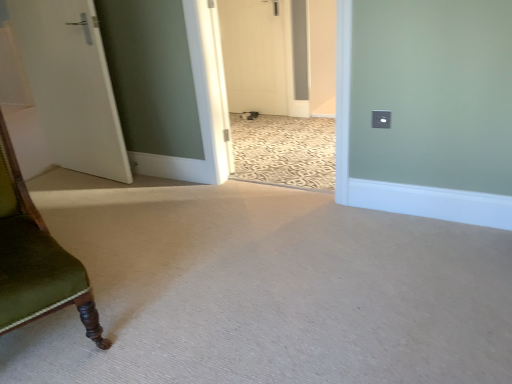
Question: Considering the relative positions of white matte door at left, which is the second door from back to front, and white matte door at center, which ranks as the first door in back-to-front order, in the image provided, is white matte door at left, which is the second door from back to front, to the right of white matte door at center, which ranks as the first door in back-to-front order, from the viewer's perspective?

Choices:
 (A) yes
 (B) no

Answer: (B)

Question: Considering the relative sizes of white matte door at left, which appears as the 1th door when viewed from the left, and white matte door at center, the 1th door from the right, in the image provided, is white matte door at left, which appears as the 1th door when viewed from the left, thinner than white matte door at center, the 1th door from the right,?

Choices:
 (A) no
 (B) yes

Answer: (A)

Question: Is white matte door at left, the second door viewed from the right, shorter than white matte door at center, which is the second door from left to right?

Choices:
 (A) no
 (B) yes

Answer: (A)

Question: Is the surface of white matte door at left, the second door viewed from the right, in direct contact with white matte door at center, which ranks as the first door in back-to-front order?

Choices:
 (A) yes
 (B) no

Answer: (B)

Question: Is white matte door at left, which is counted as the 1th door, starting from the front, surrounding white matte door at center, which ranks as the first door in back-to-front order?

Choices:
 (A) no
 (B) yes

Answer: (A)

Question: Considering their positions, is white matte door at center, which is the second door from left to right, located in front of or behind green velvet chair at left?

Choices:
 (A) front
 (B) behind

Answer: (B)

Question: In terms of size, does white matte door at center, the 1th door from the right, appear bigger or smaller than green velvet chair at left?

Choices:
 (A) big
 (B) small

Answer: (B)

Question: Considering the positions of white matte door at center, which ranks as the first door in back-to-front order, and green velvet chair at left in the image, is white matte door at center, which ranks as the first door in back-to-front order, taller or shorter than green velvet chair at left?

Choices:
 (A) short
 (B) tall

Answer: (B)

Question: Considering the positions of white matte door at center, the second door when ordered from front to back, and green velvet chair at left in the image, is white matte door at center, the second door when ordered from front to back, wider or thinner than green velvet chair at left?

Choices:
 (A) wide
 (B) thin

Answer: (B)

Question: Which is correct: white matte door at center, the second door when ordered from front to back, is inside white matte door at left, the second door viewed from the right, or outside of it?

Choices:
 (A) inside
 (B) outside

Answer: (B)

Question: Considering the relative positions of white matte door at center, the 1th door from the right, and white matte door at left, which is the second door from back to front, in the image provided, is white matte door at center, the 1th door from the right, to the left or to the right of white matte door at left, which is the second door from back to front,?

Choices:
 (A) left
 (B) right

Answer: (B)

Question: Considering the positions of white matte door at center, which ranks as the first door in back-to-front order, and white matte door at left, which is counted as the 1th door, starting from the front, in the image, is white matte door at center, which ranks as the first door in back-to-front order, taller or shorter than white matte door at left, which is counted as the 1th door, starting from the front,?

Choices:
 (A) short
 (B) tall

Answer: (A)

Question: From a real-world perspective, is white matte door at center, the 1th door from the right, positioned above or below white matte door at left, the second door viewed from the right?

Choices:
 (A) below
 (B) above

Answer: (A)

Question: Relative to white matte door at center, the 1th door from the right, is green velvet chair at left in front or behind?

Choices:
 (A) front
 (B) behind

Answer: (A)

Question: From the image's perspective, is green velvet chair at left above or below white matte door at center, which is the second door from left to right?

Choices:
 (A) below
 (B) above

Answer: (A)